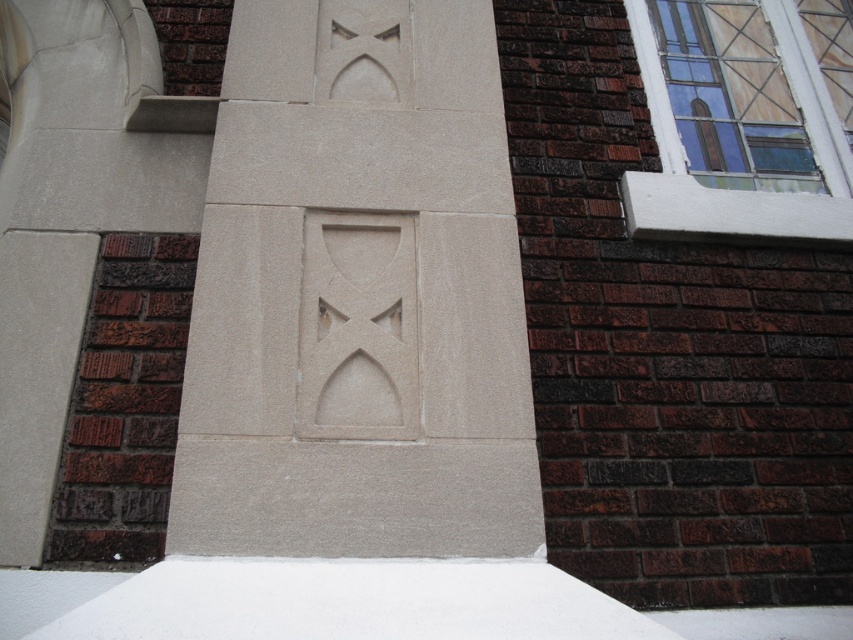
Question: Which is farther from the sanded stone carving at center?

Choices:
 (A) white matte snow at bottom
 (B) clear glass window at upper right

Answer: (B)

Question: Can you confirm if sanded stone carving at center is thinner than clear glass window at upper right?

Choices:
 (A) yes
 (B) no

Answer: (A)

Question: Which of the following is the farthest from the observer?

Choices:
 (A) sanded stone carving at center
 (B) white matte snow at bottom
 (C) clear glass window at upper right

Answer: (C)

Question: Is clear glass window at upper right to the right of white matte snow at bottom from the viewer's perspective?

Choices:
 (A) yes
 (B) no

Answer: (A)

Question: Does sanded stone carving at center lie in front of white matte snow at bottom?

Choices:
 (A) no
 (B) yes

Answer: (A)

Question: Which of the following is the farthest from the observer?

Choices:
 (A) clear glass window at upper right
 (B) sanded stone carving at center
 (C) white matte snow at bottom

Answer: (A)